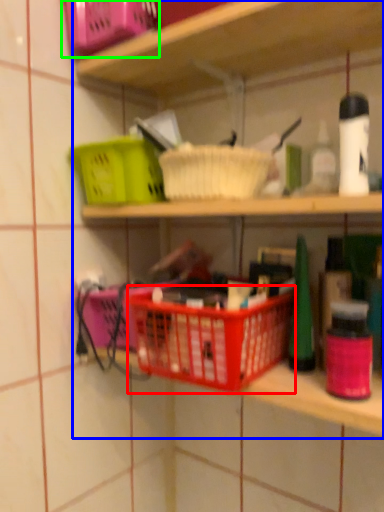
Question: Estimate the real-world distances between objects in this image. Which object is farther from basket container (highlighted by a red box), shelf (highlighted by a blue box) or basket (highlighted by a green box)?

Choices:
 (A) shelf
 (B) basket

Answer: (B)